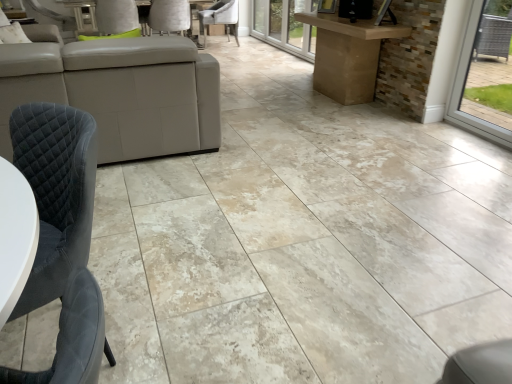
In order to face transparent glass door at upper center, should I rotate leftwards or rightwards?

Rotate right and turn 2.373 degrees.

Identify the location of transparent glass door at upper center. The image size is (512, 384). click(285, 26).

This screenshot has height=384, width=512. Describe the element at coordinates (220, 18) in the screenshot. I see `velvet grey chair at center, the 3th chair when ordered from front to back` at that location.

You are a GUI agent. You are given a task and a screenshot of the screen. Output one action in this format:
    pyautogui.click(x=<x>, y=<y>)
    Task: Click on the transparent glass door at upper center
    The image size is (512, 384).
    Given the screenshot: What is the action you would take?
    pyautogui.click(x=285, y=26)

Is velvet grey chair at lower left, acting as the first chair starting from the front, at the back of velvet grey chair at center, the 3th chair when ordered from front to back?

No.

From the image's perspective, which is above, velvet grey chair at center, acting as the third chair starting from the bottom, or velvet grey chair at lower left, the third chair from the back?

velvet grey chair at center, acting as the third chair starting from the bottom, is shown above in the image.

Starting from the velvet grey chair at lower left, the third chair from the back, which chair is the 2nd one behind? Please provide its 2D coordinates.

[(220, 18)]

Do you think velvet grey chair at center, the first chair from the top, is within velvet grey chair at lower left, the third chair from the back, or outside of it?

The correct answer is: outside.

Would you consider velvet grey chair at lower left, the third chair from the back, to be distant from velvet grey chair at center, the first chair positioned from the back?

velvet grey chair at lower left, the third chair from the back, is far away from velvet grey chair at center, the first chair positioned from the back.

Considering the sizes of objects velvet grey chair at lower left, the third chair positioned from the top, and velvet grey chair at center, the first chair positioned from the back, in the image provided, who is smaller, velvet grey chair at lower left, the third chair positioned from the top, or velvet grey chair at center, the first chair positioned from the back,?

Smaller between the two is velvet grey chair at lower left, the third chair positioned from the top.

The height and width of the screenshot is (384, 512). I want to click on chair that is the 2nd one when counting upward from the velvet grey chair at lower left, the third chair positioned from the top (from the image's perspective), so click(220, 18).

Would you say velvet grey chair at center, the first chair positioned from the back, is part of velvet grey chair at lower left, acting as the first chair starting from the front,'s contents?

Definitely not — velvet grey chair at center, the first chair positioned from the back, is not inside velvet grey chair at lower left, acting as the first chair starting from the front.

In the scene shown: Is velvet grey chair at center, the 3th chair when ordered from front to back, situated inside transparent glass door at upper center or outside?

The correct answer is: outside.

Find the location of `glass door in front of the velvet grey chair at center, acting as the third chair starting from the bottom`. glass door in front of the velvet grey chair at center, acting as the third chair starting from the bottom is located at coordinates (285, 26).

Considering the sizes of velvet grey chair at center, acting as the third chair starting from the bottom, and transparent glass door at upper center in the image, is velvet grey chair at center, acting as the third chair starting from the bottom, wider or thinner than transparent glass door at upper center?

In the image, velvet grey chair at center, acting as the third chair starting from the bottom, appears to be wider than transparent glass door at upper center.

From a real-world perspective, relative to transparent glass door at upper center, is velvet grey chair at center, the first chair positioned from the back, vertically above or below?

From a real-world perspective, velvet grey chair at center, the first chair positioned from the back, is physically below transparent glass door at upper center.

Is transparent glass door at upper center not close to velvet grey chair at lower left, the third chair from the back?

transparent glass door at upper center is far away from velvet grey chair at lower left, the third chair from the back.

Based on the photo, between transparent glass door at upper center and velvet grey chair at lower left, which appears as the 1th chair when ordered from the bottom, which one has less height?

transparent glass door at upper center.

Is transparent glass door at upper center smaller than velvet grey chair at lower left, acting as the first chair starting from the front?

Correct, transparent glass door at upper center occupies less space than velvet grey chair at lower left, acting as the first chair starting from the front.

Does velvet grey chair at lower left, acting as the first chair starting from the front, touch transparent glass door at upper center?

There is a gap between velvet grey chair at lower left, acting as the first chair starting from the front, and transparent glass door at upper center.

From a real-world perspective, is velvet grey chair at lower left, the third chair from the back, below transparent glass door at upper center?

Yes, from a real-world perspective, velvet grey chair at lower left, the third chair from the back, is beneath transparent glass door at upper center.

Is velvet grey chair at lower left, acting as the first chair starting from the front, to the left or to the right of transparent glass door at upper center in the image?

Based on their positions, velvet grey chair at lower left, acting as the first chair starting from the front, is located to the left of transparent glass door at upper center.

Is velvet grey chair at lower left, which appears as the 1th chair when ordered from the bottom, oriented away from transparent glass door at upper center?

velvet grey chair at lower left, which appears as the 1th chair when ordered from the bottom, is not turned away from transparent glass door at upper center.

Considering the sizes of objects transparent glass door at upper center and white leather chair at upper center, which appears as the 2th chair when viewed from the top, in the image provided, who is wider, transparent glass door at upper center or white leather chair at upper center, which appears as the 2th chair when viewed from the top,?

Wider between the two is white leather chair at upper center, which appears as the 2th chair when viewed from the top.

Measure the distance from transparent glass door at upper center to white leather chair at upper center, which ranks as the 2th chair in bottom-to-top order.

transparent glass door at upper center and white leather chair at upper center, which ranks as the 2th chair in bottom-to-top order, are 1.65 meters apart from each other.

Consider the image. Visually, is transparent glass door at upper center positioned to the left or to the right of white leather chair at upper center, which appears as the 2th chair when viewed from the front?

In the image, transparent glass door at upper center appears on the right side of white leather chair at upper center, which appears as the 2th chair when viewed from the front.

Looking at the image, does transparent glass door at upper center seem bigger or smaller compared to white leather chair at upper center, which appears as the 2th chair when viewed from the top?

transparent glass door at upper center is smaller than white leather chair at upper center, which appears as the 2th chair when viewed from the top.

Are white leather chair at upper center, arranged as the second chair when viewed from the back, and velvet grey chair at center, the first chair from the top, far apart?

white leather chair at upper center, arranged as the second chair when viewed from the back, is far away from velvet grey chair at center, the first chair from the top.

From the image's perspective, between white leather chair at upper center, arranged as the second chair when viewed from the back, and velvet grey chair at center, the 3th chair when ordered from front to back, who is located below?

white leather chair at upper center, arranged as the second chair when viewed from the back, from the image's perspective.

Considering the sizes of white leather chair at upper center, arranged as the second chair when viewed from the back, and velvet grey chair at center, the 3th chair when ordered from front to back, in the image, is white leather chair at upper center, arranged as the second chair when viewed from the back, wider or thinner than velvet grey chair at center, the 3th chair when ordered from front to back,?

Considering their sizes, white leather chair at upper center, arranged as the second chair when viewed from the back, looks slimmer than velvet grey chair at center, the 3th chair when ordered from front to back.

Is the depth of white leather chair at upper center, arranged as the second chair when viewed from the back, less than that of velvet grey chair at center, acting as the third chair starting from the bottom?

That is True.

Image resolution: width=512 pixels, height=384 pixels. I want to click on chair below the velvet grey chair at lower left, which appears as the 1th chair when ordered from the bottom (from a real-world perspective), so click(x=220, y=18).

This screenshot has width=512, height=384. I want to click on chair that is the 2nd one when counting backward from the velvet grey chair at lower left, the third chair from the back, so click(220, 18).

Looking at the image, which one is located closer to white leather chair at upper center, arranged as the second chair when viewed from the back, transparent glass door at upper center or velvet grey chair at center, the first chair from the top?

velvet grey chair at center, the first chair from the top.

From the image, which object appears to be farther from transparent glass door at upper center, velvet grey chair at lower left, the third chair from the back, or velvet grey chair at center, the 3th chair when ordered from front to back?

velvet grey chair at lower left, the third chair from the back, is positioned further to the anchor transparent glass door at upper center.

Which object lies nearer to the anchor point velvet grey chair at lower left, the third chair positioned from the top, transparent glass door at upper center or velvet grey chair at center, the first chair positioned from the back?

transparent glass door at upper center.

Estimate the real-world distances between objects in this image. Which object is closer to velvet grey chair at lower left, which appears as the 1th chair when ordered from the bottom, velvet grey chair at center, the first chair from the top, or white leather chair at upper center, which ranks as the 2th chair in bottom-to-top order?

white leather chair at upper center, which ranks as the 2th chair in bottom-to-top order, lies closer to velvet grey chair at lower left, which appears as the 1th chair when ordered from the bottom, than the other object.

Which object lies further to the anchor point transparent glass door at upper center, white leather chair at upper center, which ranks as the 2th chair in bottom-to-top order, or velvet grey chair at lower left, acting as the first chair starting from the front?

velvet grey chair at lower left, acting as the first chair starting from the front, is positioned further to the anchor transparent glass door at upper center.

When comparing their distances from velvet grey chair at center, acting as the third chair starting from the bottom, does transparent glass door at upper center or velvet grey chair at lower left, the third chair positioned from the top, seem further?

velvet grey chair at lower left, the third chair positioned from the top, is further to velvet grey chair at center, acting as the third chair starting from the bottom.

Looking at the image, which one is located closer to white leather chair at upper center, which appears as the 2th chair when viewed from the front, velvet grey chair at lower left, the third chair from the back, or velvet grey chair at center, the first chair from the top?

The object closer to white leather chair at upper center, which appears as the 2th chair when viewed from the front, is velvet grey chair at center, the first chair from the top.

When comparing their distances from velvet grey chair at center, the first chair from the top, does white leather chair at upper center, which appears as the 2th chair when viewed from the front, or transparent glass door at upper center seem closer?

transparent glass door at upper center.

Where is `glass door between velvet grey chair at lower left, the third chair from the back, and velvet grey chair at center, the first chair from the top, along the z-axis`? The height and width of the screenshot is (384, 512). glass door between velvet grey chair at lower left, the third chair from the back, and velvet grey chair at center, the first chair from the top, along the z-axis is located at coordinates (285, 26).

This screenshot has width=512, height=384. Identify the location of chair positioned between velvet grey chair at lower left, which appears as the 1th chair when ordered from the bottom, and velvet grey chair at center, the first chair positioned from the back, from near to far. (169, 16).

Find the location of a particular element. chair located between velvet grey chair at lower left, acting as the first chair starting from the front, and transparent glass door at upper center in the depth direction is located at coordinates (169, 16).